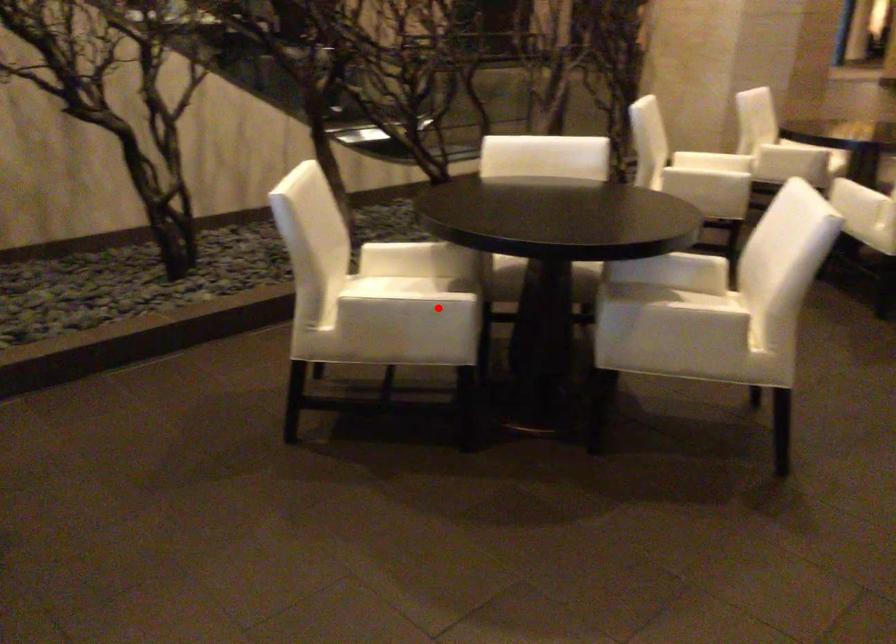
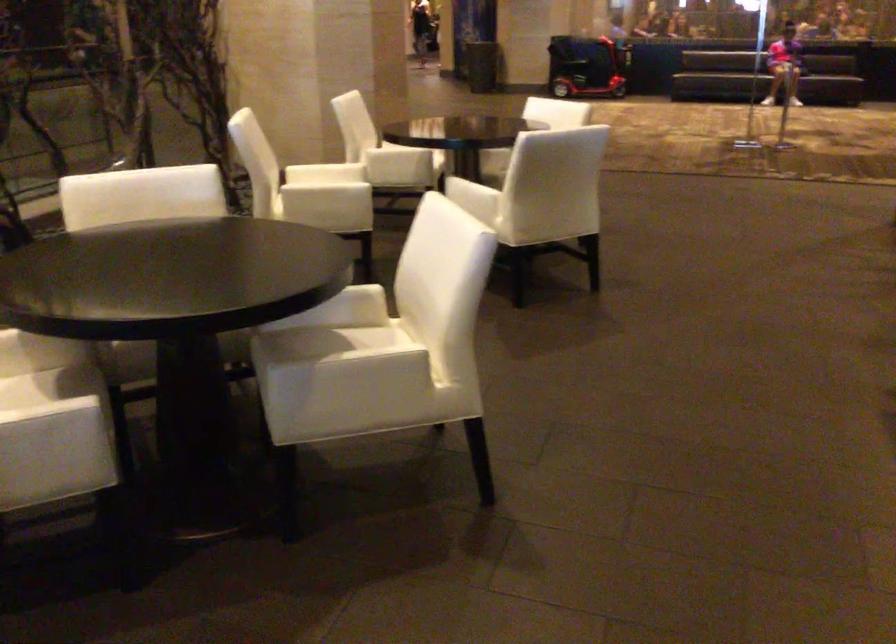
Locate, in the second image, the point that corresponds to the highlighted location in the first image.

(56, 422)